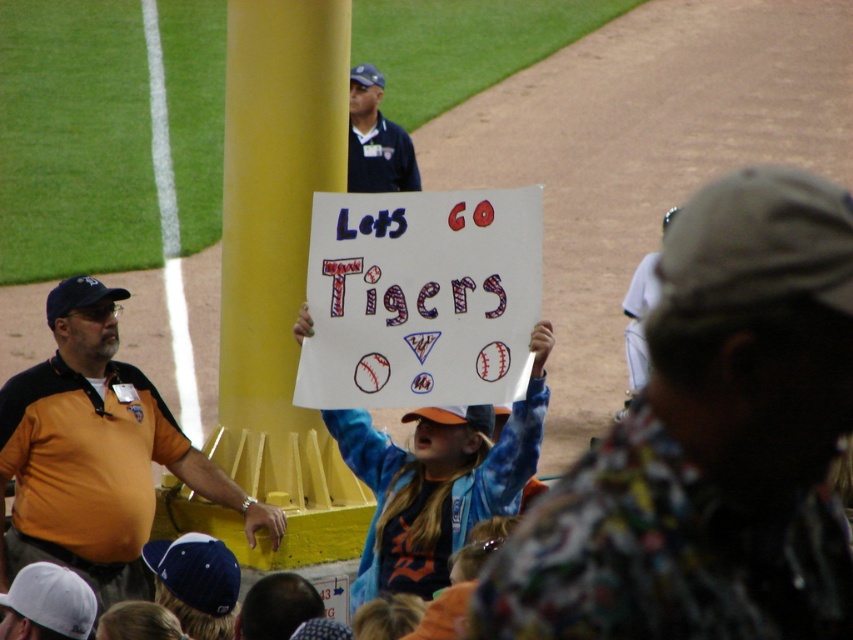
Is flannel shirt at center wider than blue uniform at upper center?

Correct, the width of flannel shirt at center exceeds that of blue uniform at upper center.

Where is `flannel shirt at center`? flannel shirt at center is located at coordinates (711, 444).

What are the coordinates of `flannel shirt at center` in the screenshot? It's located at (711, 444).

Looking at this image, is orange jersey at left wider than blue uniform at upper center?

Yes.

Between point (90, 541) and point (347, 170), which one is positioned behind?

The point (347, 170) is behind.

Identify the location of orange jersey at left. This screenshot has width=853, height=640. (96, 454).

Who is shorter, flannel shirt at center or yellow painted pole at center?

yellow painted pole at center is shorter.

The image size is (853, 640). What are the coordinates of `flannel shirt at center` in the screenshot? It's located at (711, 444).

Find the location of a particular element. The image size is (853, 640). flannel shirt at center is located at coordinates (711, 444).